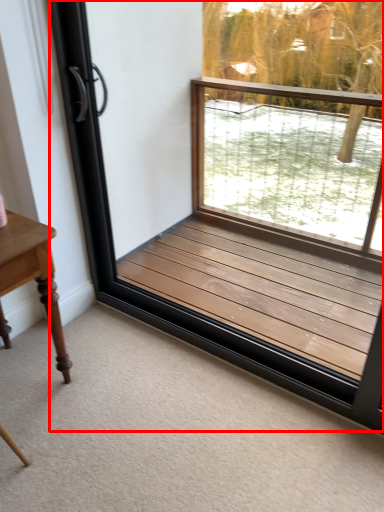
Question: Where is window frame (annotated by the red box) located in relation to table in the image?

Choices:
 (A) left
 (B) right

Answer: (B)